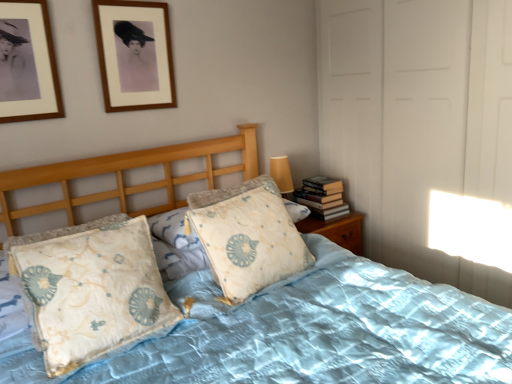
Question: In the image, is wooden picture frame at upper left, arranged as the 1th picture frame when viewed from the left, positioned in front of or behind wooden picture frame at upper left, marked as the second picture frame in a left-to-right arrangement?

Choices:
 (A) front
 (B) behind

Answer: (A)

Question: Is point (37, 114) positioned closer to the camera than point (102, 86)?

Choices:
 (A) closer
 (B) farther

Answer: (A)

Question: Estimate the real-world distances between objects in this image. Which object is closer to the wooden picture frame at upper left, arranged as the 1th picture frame when viewed from the left?

Choices:
 (A) light blue quilted bed at center
 (B) light blue fabric pillow at center, the second pillow from the left
 (C) light blue fabric pillow at center, which is the 2th pillow from right to left
 (D) wooden picture frame at upper left, the 2th picture frame positioned from the front
 (E) hardcover books at right

Answer: (D)

Question: Which object is positioned farthest from the light blue quilted bed at center?

Choices:
 (A) wooden picture frame at upper left, the 1th picture frame when ordered from back to front
 (B) wooden picture frame at upper left, acting as the second picture frame starting from the right
 (C) light blue fabric pillow at center, which is the 1th pillow in left-to-right order
 (D) hardcover books at right
 (E) light blue fabric pillow at center, the second pillow from the left

Answer: (B)